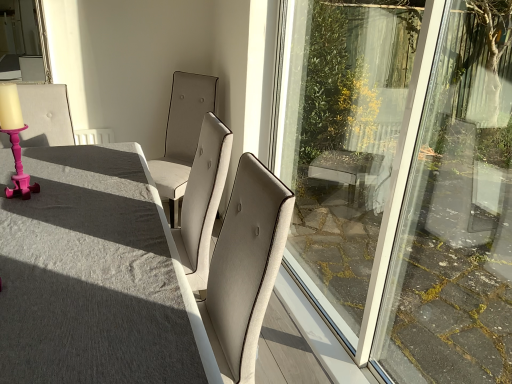
Locate an element on the screen. Image resolution: width=512 pixels, height=384 pixels. vacant space behind pink wood candle holder at left is located at coordinates (46, 178).